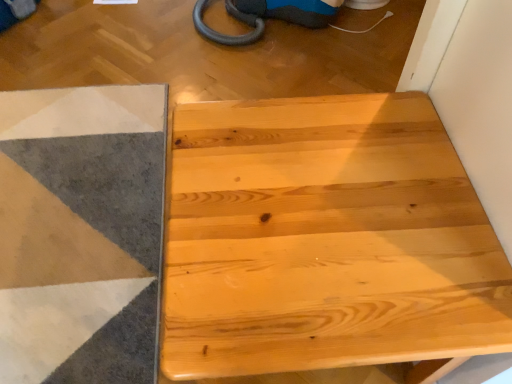
Where is `blank space situated above soft gray carpet at lower left (from a real-world perspective)`? blank space situated above soft gray carpet at lower left (from a real-world perspective) is located at coordinates pos(45,199).